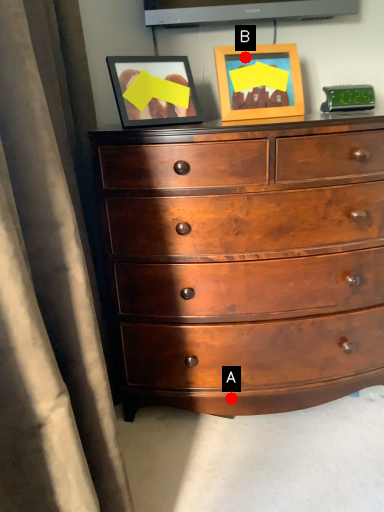
Question: Two points are circled on the image, labeled by A and B beside each circle. Which point is farther to the camera?

Choices:
 (A) A is further
 (B) B is further

Answer: (A)